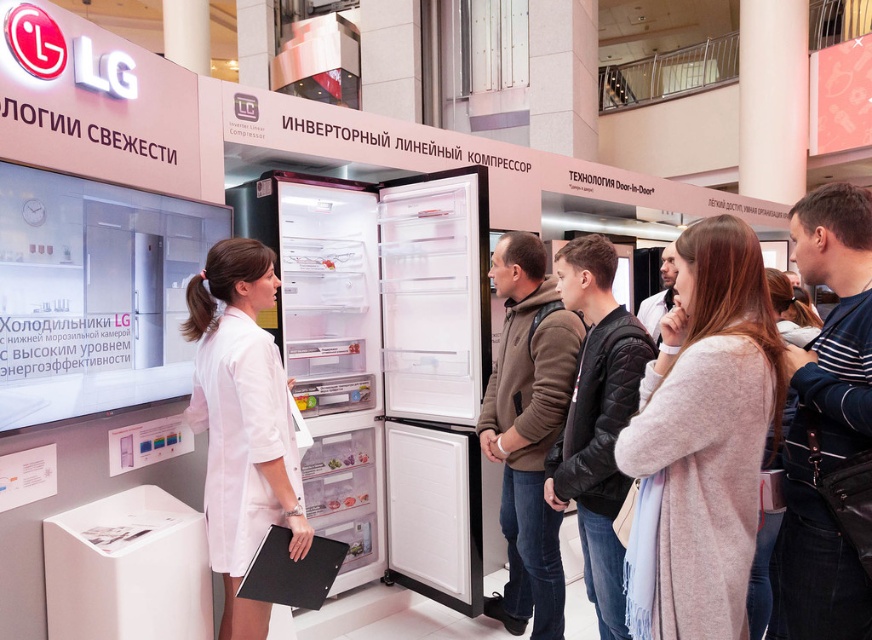
Is the position of white matte uniform at center less distant than that of brown hoodie at center?

That is True.

Looking at this image, can you confirm if white matte uniform at center is bigger than brown hoodie at center?

No.

Is point (264, 470) in front of point (535, 532)?

Yes, it is in front of point (535, 532).

This screenshot has width=872, height=640. I want to click on white matte uniform at center, so click(242, 422).

Does light beige sweater at center right appear on the left side of dark blue striped shirt at center right?

Indeed, light beige sweater at center right is positioned on the left side of dark blue striped shirt at center right.

Measure the distance between point (652, 602) and camera.

Point (652, 602) and camera are 5.44 feet apart.

Image resolution: width=872 pixels, height=640 pixels. What are the coordinates of `light beige sweater at center right` in the screenshot? It's located at (707, 429).

Does point (465, 589) come behind point (787, 436)?

Yes, point (465, 589) is farther from viewer.

Which is behind, point (426, 300) or point (852, 627)?

The point (426, 300) is more distant.

Image resolution: width=872 pixels, height=640 pixels. What are the coordinates of `white matte refrigerator at center` in the screenshot? It's located at (407, 385).

Locate an element on the screen. This screenshot has width=872, height=640. white matte refrigerator at center is located at coordinates (407, 385).